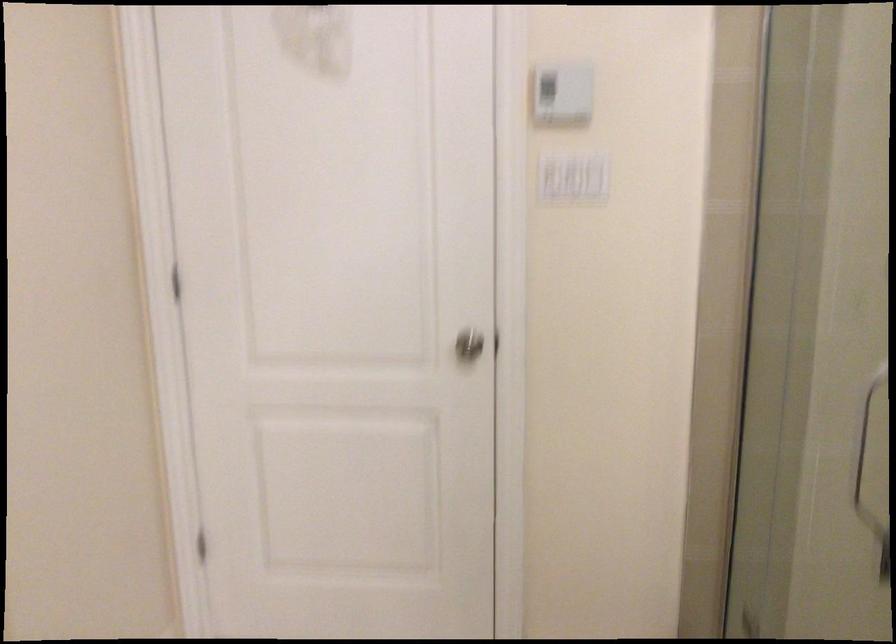
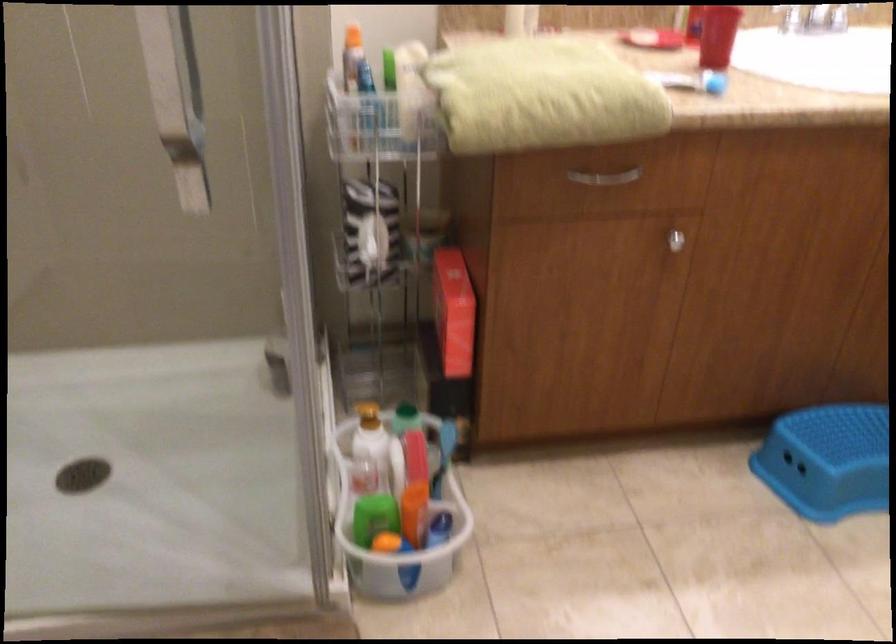
How did the camera likely rotate?

The rotation direction of the camera is right-down.